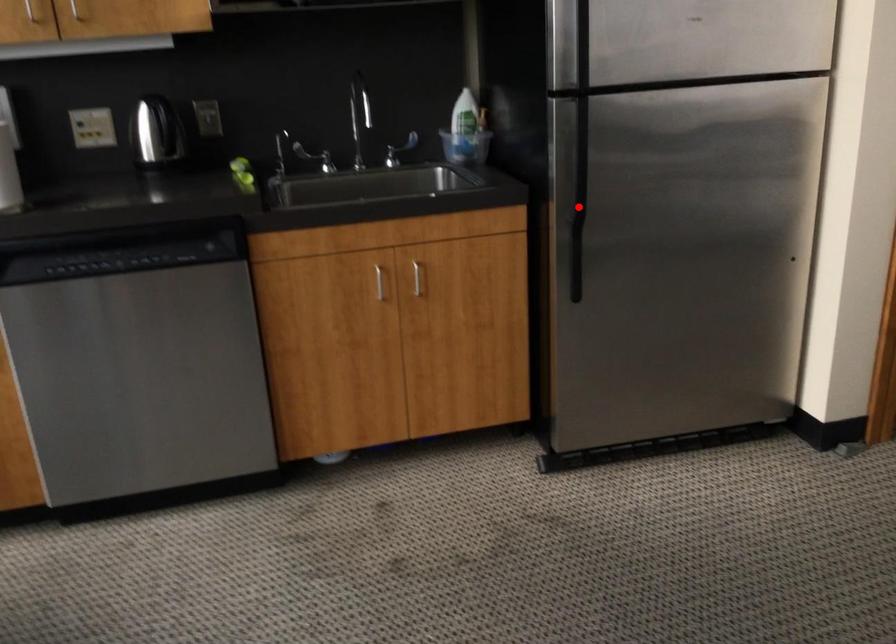
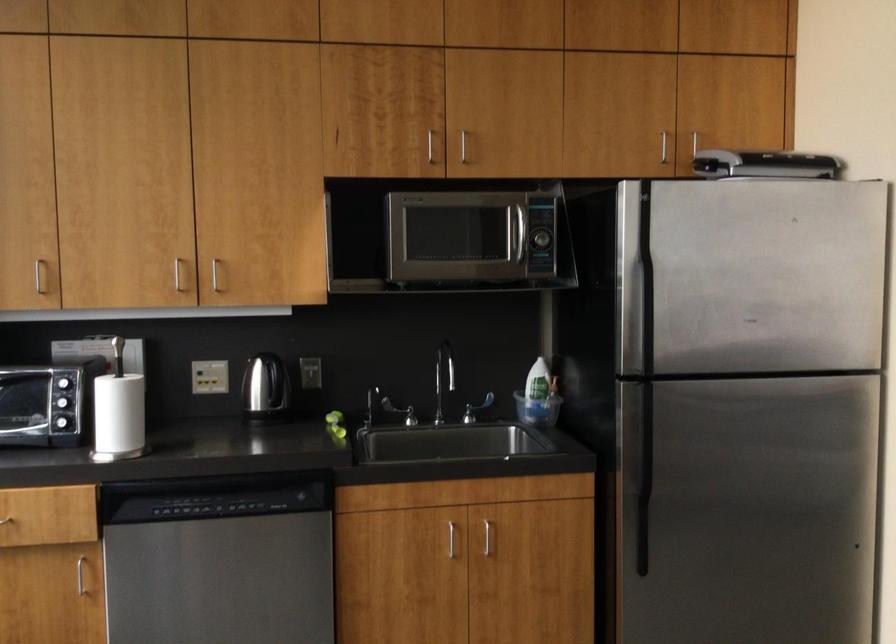
The point at the highlighted location is marked in the first image. Where is the corresponding point in the second image?

(643, 480)